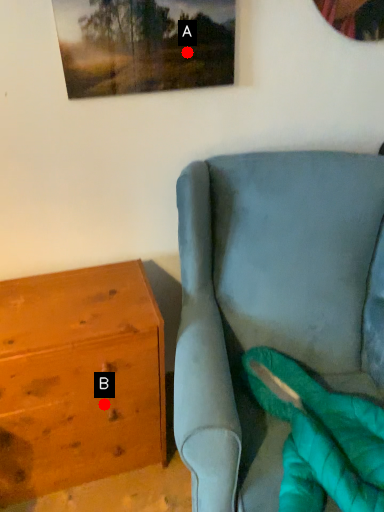
Question: Two points are circled on the image, labeled by A and B beside each circle. Which point is farther from the camera taking this photo?

Choices:
 (A) A is further
 (B) B is further

Answer: (B)